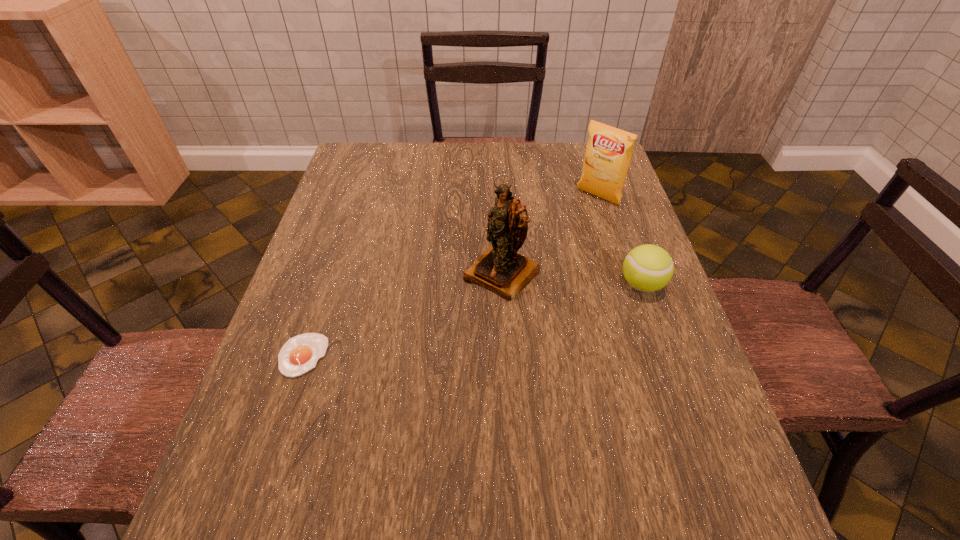
This screenshot has height=540, width=960. In order to click on vacant space at the left edge in this screenshot , I will do `click(324, 314)`.

Locate an element on the screen. This screenshot has width=960, height=540. vacant space at the right edge of the desktop is located at coordinates (636, 294).

What are the coordinates of `free region at the far left corner of the desktop` in the screenshot? It's located at (368, 151).

In the image, there is a desktop. What are the coordinates of `free space at the near right corner` in the screenshot? It's located at (722, 455).

At what (x,y) coordinates should I click in order to perform the action: click on unoccupied area between the farthest object and the tallest object. Please return your answer as a coordinate pair (x, y). Looking at the image, I should click on (550, 235).

Image resolution: width=960 pixels, height=540 pixels. I want to click on free point between the nearest object and the tennis ball, so click(x=472, y=320).

Locate an element on the screen. This screenshot has width=960, height=540. vacant point located between the tennis ball and the crisp (potato chip) is located at coordinates (620, 241).

Find the location of a particular element. This screenshot has height=540, width=960. unoccupied area between the third tallest object and the third object from right to left is located at coordinates (571, 279).

This screenshot has width=960, height=540. I want to click on vacant point located between the third object from right to left and the tennis ball, so (x=571, y=279).

Find the location of a particular element. The height and width of the screenshot is (540, 960). free space between the egg yolk and the tallest object is located at coordinates (402, 314).